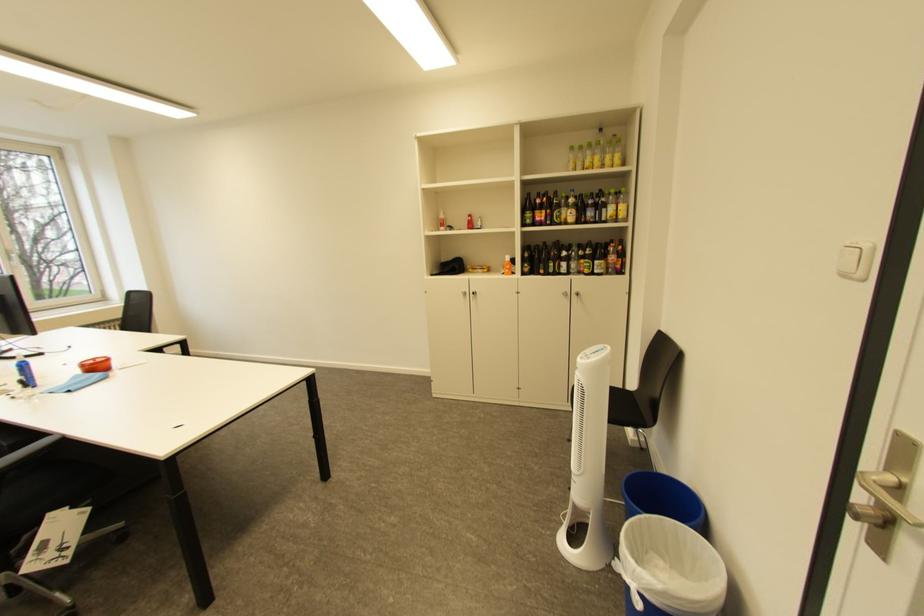
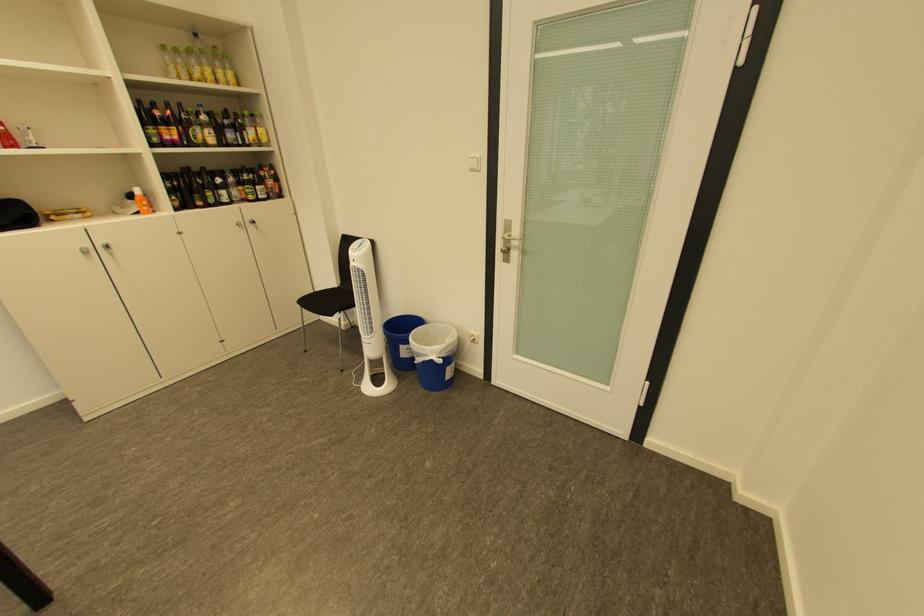
Find the pixel in the second image that matches the point at 538,216 in the first image.

(162, 132)